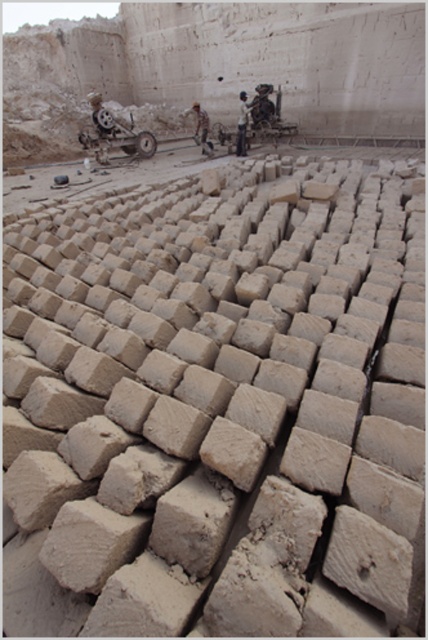
You are a visitor at the brick facility and want to take a photo of the metallic silver motorbike at upper left without including the light brown leather jacket at center in the frame. Is it possible to do so?

The metallic silver motorbike at upper left is located below the light brown leather jacket at center, so you can position yourself lower to frame the motorbike without the jacket in the shot.

You are standing at the brick facility and want to place a new brick between the two points labeled point (151, 134) and point (199, 120). Which point should the brick be closer to if it needs to be nearer to the camera?

The brick should be placed closer to point (151, 134) since it is closer to the camera compared to point (199, 120).